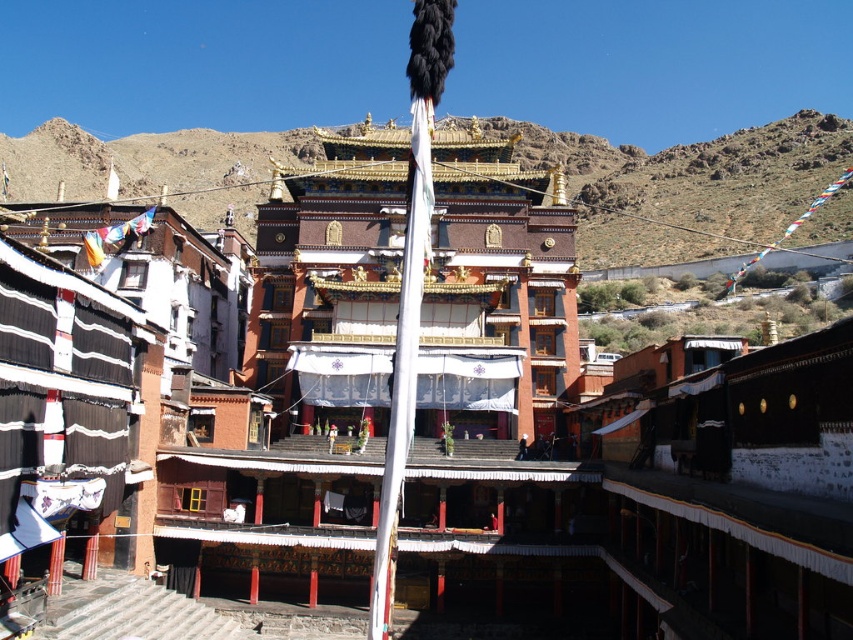
Who is shorter, brown rocky mountain at upper center or white fabric flag pole at center?

white fabric flag pole at center

The height and width of the screenshot is (640, 853). Identify the location of brown rocky mountain at upper center. (688, 184).

Does point (770, 224) come in front of point (369, 636)?

No, (770, 224) is behind (369, 636).

The height and width of the screenshot is (640, 853). What are the coordinates of `brown rocky mountain at upper center` in the screenshot? It's located at (688, 184).